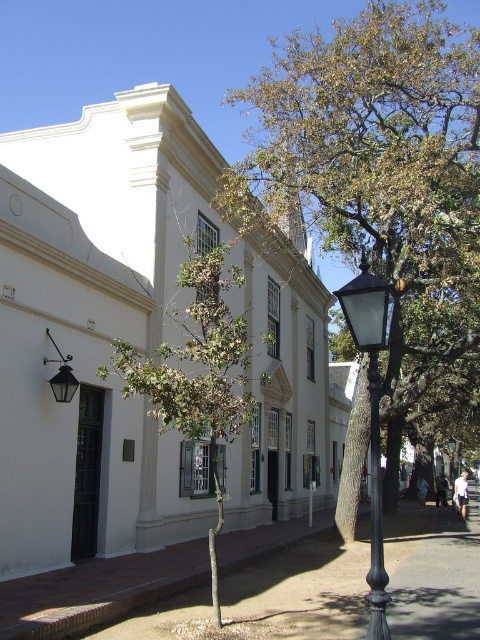
You are a city planner evaluating the space in front of the colonial building. You need to determine if the brown leafy tree at center can be moved to the area currently occupied by the brown gravel pavement at lower left. Based on their widths, is this feasible?

The brown leafy tree at center is wider than the brown gravel pavement at lower left, so moving it there would not be feasible as the tree requires more space than the pavement area provides.

You are a pedestrian standing at the entrance of the colonial building. You want to walk to the brown gravel pavement at lower left. Which direction should you walk relative to the black metal streetlight at center?

The brown gravel pavement at lower left is in front of the black metal streetlight at center, so you should walk towards the direction facing away from the streetlight to reach the gravel pavement.

You are a gardener who needs to water the brown leafy tree at center and the brown gravel pavement at lower left. If your watering can holds 10 liters and each liter covers 2 square feet, how many times do you need to refill your watering can to cover both areas?

The brown leafy tree at center and brown gravel pavement at lower left are 39.80 feet apart. However, the question requires calculating the area to determine refills, but the provided information only gives distance between them, not their individual areas. Thus, insufficient data to answer.